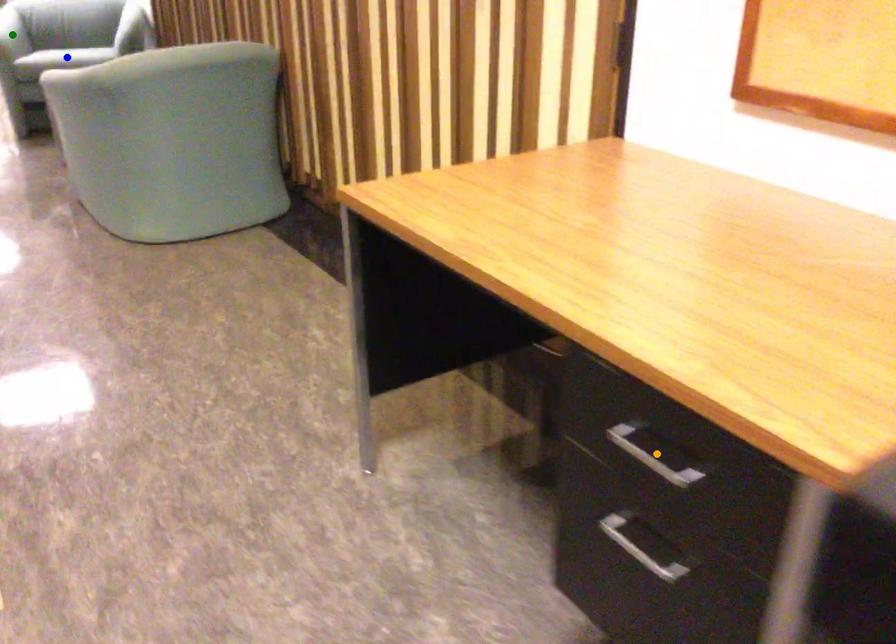
Order these from nearest to farthest:
blue point, orange point, green point

orange point
blue point
green point